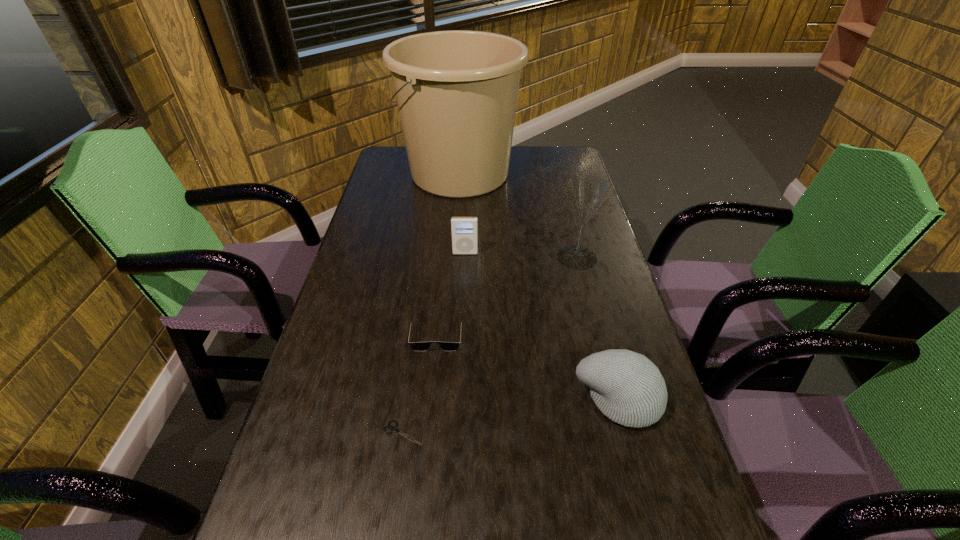
Locate an element on the screen. bucket is located at coordinates pos(456,91).

Where is `the farthest object`? This screenshot has height=540, width=960. the farthest object is located at coordinates (456, 91).

This screenshot has height=540, width=960. I want to click on flute glass, so click(x=588, y=195).

In order to click on iPod in this screenshot , I will do `click(464, 230)`.

The width and height of the screenshot is (960, 540). What are the coordinates of `beanie` in the screenshot? It's located at (628, 388).

I want to click on the third nearest object, so click(x=416, y=346).

Find the location of a particular element. Image resolution: width=960 pixels, height=540 pixels. sunglasses is located at coordinates (416, 346).

Where is `shears`? This screenshot has height=540, width=960. shears is located at coordinates (393, 428).

Where is `blank area located 0.090m on the front of the bucket`? The height and width of the screenshot is (540, 960). blank area located 0.090m on the front of the bucket is located at coordinates (457, 222).

Locate an element on the screen. This screenshot has width=960, height=540. blank space located 0.170m on the back of the flute glass is located at coordinates (565, 212).